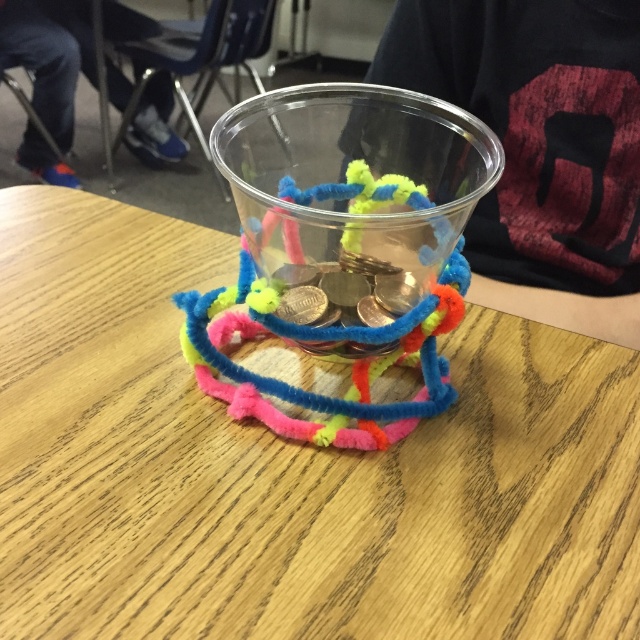
Which is more to the left, wooden table at center or shiny metallic coins at center?

wooden table at center

Between wooden table at center and shiny metallic coins at center, which one appears on the right side from the viewer's perspective?

shiny metallic coins at center is more to the right.

Which is in front, point (17, 228) or point (353, 292)?

Point (353, 292) is in front.

Locate an element on the screen. The height and width of the screenshot is (640, 640). wooden table at center is located at coordinates (289, 467).

Is translucent plastic cup at center positioned in front of shiny metallic coins at center?

Yes, translucent plastic cup at center is in front of shiny metallic coins at center.

From the picture: Is translucent plastic cup at center positioned behind shiny metallic coins at center?

No.

Which is behind, point (228, 177) or point (372, 353)?

Positioned behind is point (372, 353).

Identify the location of translucent plastic cup at center. (342, 248).

What do you see at coordinates (289, 467) in the screenshot? I see `wooden table at center` at bounding box center [289, 467].

Based on the photo, does wooden table at center have a greater width compared to translucent plastic cup at center?

Yes, wooden table at center is wider than translucent plastic cup at center.

Is point (394, 474) in front of point (394, 301)?

Yes.

Locate an element on the screen. wooden table at center is located at coordinates (289, 467).